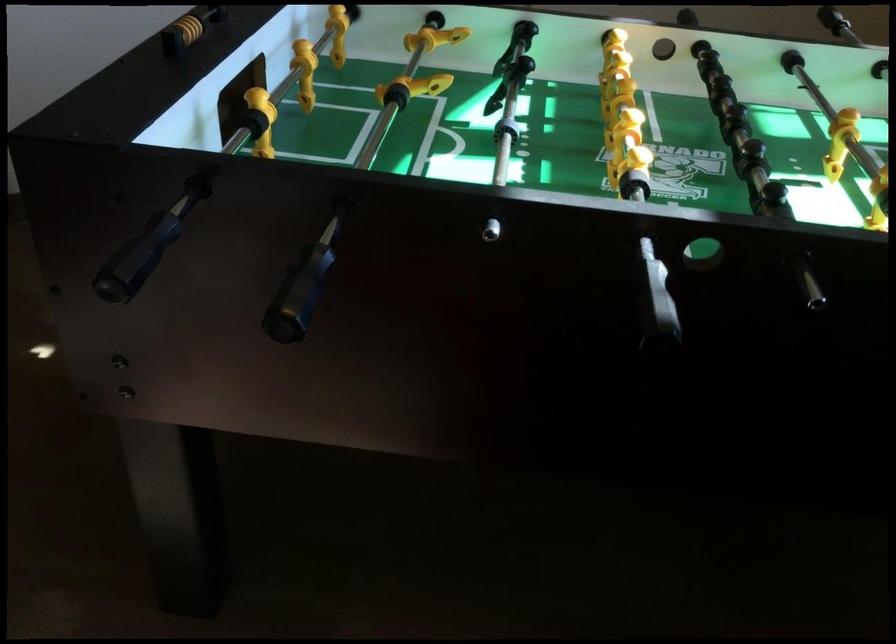
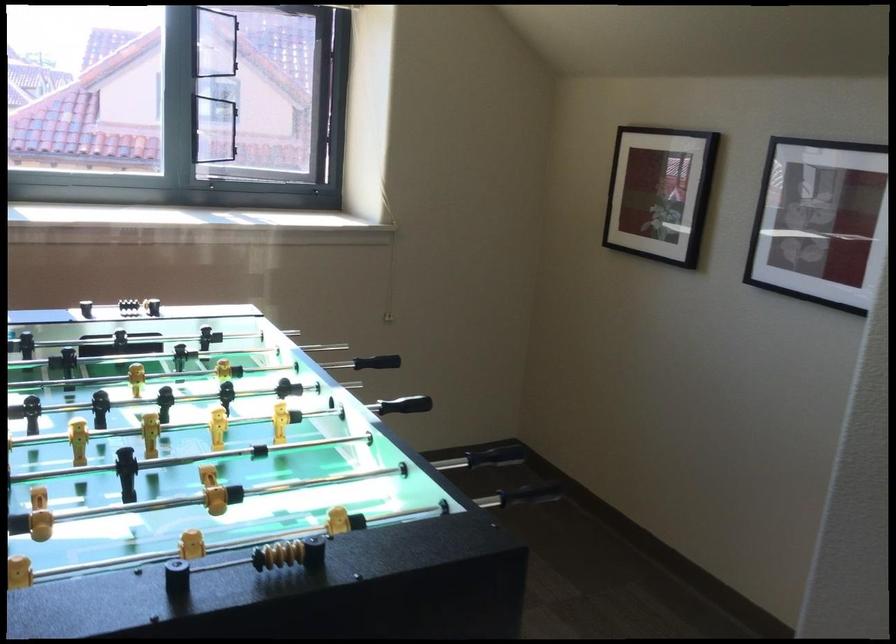
In the second image, find the point that corresponds to (371,317) in the first image.

(497, 453)